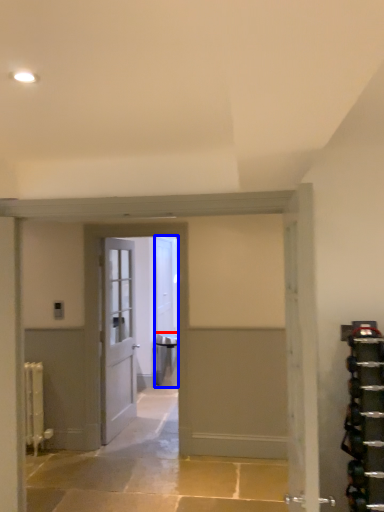
Question: Which point is closer to the camera, furniture (highlighted by a red box) or door (highlighted by a blue box)?

Choices:
 (A) furniture
 (B) door

Answer: (A)